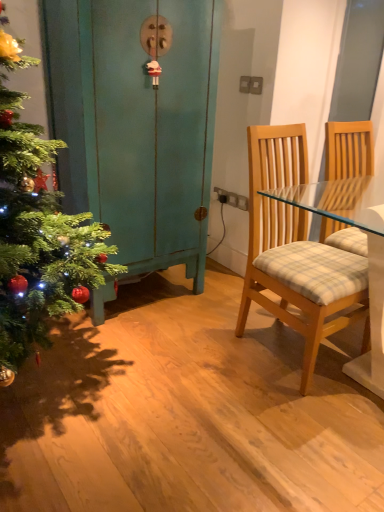
Question: Are light wood/glass chair at right and teal painted wood dresser at left located far from each other?

Choices:
 (A) no
 (B) yes

Answer: (A)

Question: Is light wood/glass chair at right to the right of teal painted wood dresser at left from the viewer's perspective?

Choices:
 (A) yes
 (B) no

Answer: (A)

Question: From a real-world perspective, is light wood/glass chair at right located beneath teal painted wood dresser at left?

Choices:
 (A) yes
 (B) no

Answer: (A)

Question: Is light wood/glass chair at right next to teal painted wood dresser at left?

Choices:
 (A) yes
 (B) no

Answer: (B)

Question: Is light wood/glass chair at right positioned beyond the bounds of teal painted wood dresser at left?

Choices:
 (A) no
 (B) yes

Answer: (B)

Question: From a real-world perspective, is light wood/glass chair at right located higher than teal painted wood dresser at left?

Choices:
 (A) no
 (B) yes

Answer: (A)

Question: Considering the relative positions of teal painted wood dresser at left and light wood/glass chair at right in the image provided, is teal painted wood dresser at left behind light wood/glass chair at right?

Choices:
 (A) yes
 (B) no

Answer: (A)

Question: From a real-world perspective, does teal painted wood dresser at left stand above light wood/glass chair at right?

Choices:
 (A) no
 (B) yes

Answer: (B)

Question: Can you confirm if teal painted wood dresser at left is shorter than light wood/glass chair at right?

Choices:
 (A) no
 (B) yes

Answer: (A)

Question: Is teal painted wood dresser at left looking in the opposite direction of light wood/glass chair at right?

Choices:
 (A) yes
 (B) no

Answer: (B)

Question: Can you confirm if teal painted wood dresser at left is thinner than light wood/glass chair at right?

Choices:
 (A) no
 (B) yes

Answer: (B)

Question: Is teal painted wood dresser at left in front of light wood/glass chair at right?

Choices:
 (A) yes
 (B) no

Answer: (B)

Question: From the image's perspective, relative to teal painted wood dresser at left, is light wood/glass chair at right above or below?

Choices:
 (A) below
 (B) above

Answer: (A)